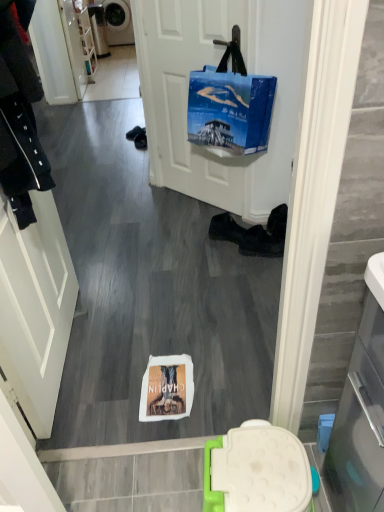
Question: Does metallic gray washing machine at upper left have a lesser height compared to white matte door at center?

Choices:
 (A) yes
 (B) no

Answer: (A)

Question: Is there a large distance between metallic gray washing machine at upper left and white matte door at center?

Choices:
 (A) no
 (B) yes

Answer: (B)

Question: From the image's perspective, is metallic gray washing machine at upper left located beneath white matte door at center?

Choices:
 (A) no
 (B) yes

Answer: (A)

Question: Is metallic gray washing machine at upper left aimed at white matte door at center?

Choices:
 (A) no
 (B) yes

Answer: (B)

Question: Can you confirm if metallic gray washing machine at upper left is positioned to the left of white matte door at center?

Choices:
 (A) no
 (B) yes

Answer: (B)

Question: Is black leather boots at lower center, arranged as the 1th footwear when viewed from the right, situated inside white glossy door at left or outside?

Choices:
 (A) inside
 (B) outside

Answer: (B)

Question: In terms of width, does black leather boots at lower center, the second footwear positioned from the left, look wider or thinner when compared to white glossy door at left?

Choices:
 (A) thin
 (B) wide

Answer: (B)

Question: Is black leather boots at lower center, the second footwear positioned from the left, in front of or behind white glossy door at left in the image?

Choices:
 (A) front
 (B) behind

Answer: (B)

Question: From a real-world perspective, is black leather boots at lower center, arranged as the 1th footwear when viewed from the right, above or below white glossy door at left?

Choices:
 (A) below
 (B) above

Answer: (A)

Question: From the image's perspective, is white matte door at center above or below black leather shoes at center, which ranks as the first footwear in left-to-right order?

Choices:
 (A) below
 (B) above

Answer: (B)

Question: Which is correct: white matte door at center is inside black leather shoes at center, acting as the 2th footwear starting from the right, or outside of it?

Choices:
 (A) inside
 (B) outside

Answer: (B)

Question: Considering the relative positions of white matte door at center and black leather shoes at center, acting as the 2th footwear starting from the right, in the image provided, is white matte door at center to the left or to the right of black leather shoes at center, acting as the 2th footwear starting from the right,?

Choices:
 (A) right
 (B) left

Answer: (B)

Question: Considering the positions of point (173, 23) and point (215, 238), is point (173, 23) closer or farther from the camera than point (215, 238)?

Choices:
 (A) farther
 (B) closer

Answer: (B)

Question: Considering the positions of black leather shoe at lower center and white glossy door at left in the image, is black leather shoe at lower center taller or shorter than white glossy door at left?

Choices:
 (A) short
 (B) tall

Answer: (A)

Question: Considering their positions, is black leather shoe at lower center located in front of or behind white glossy door at left?

Choices:
 (A) front
 (B) behind

Answer: (B)